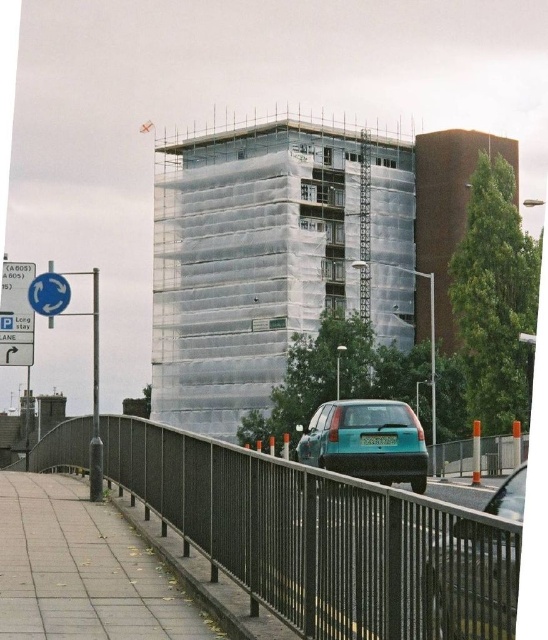
Looking at this image, is teal matte hatchback at center smaller than blue plastic sign at upper left?

Actually, teal matte hatchback at center might be larger than blue plastic sign at upper left.

Is teal matte hatchback at center closer to the viewer compared to blue plastic sign at upper left?

Yes, it is in front of blue plastic sign at upper left.

Find the location of a particular element. Image resolution: width=548 pixels, height=640 pixels. teal matte hatchback at center is located at coordinates (366, 442).

The width and height of the screenshot is (548, 640). What are the coordinates of `teal matte hatchback at center` in the screenshot? It's located at [x=366, y=442].

Does white plastic building at center have a larger size compared to black metal fence at lower center?

Yes.

Is white plastic building at center closer to camera compared to black metal fence at lower center?

No, it is behind black metal fence at lower center.

Is point (370, 192) positioned in front of point (453, 508)?

No, (370, 192) is behind (453, 508).

Image resolution: width=548 pixels, height=640 pixels. Identify the location of white plastic building at center. (270, 256).

This screenshot has width=548, height=640. Identify the location of teal matte car at center. (475, 582).

Which is in front, point (476, 588) or point (7, 333)?

Point (476, 588) is more forward.

I want to click on teal matte car at center, so click(475, 582).